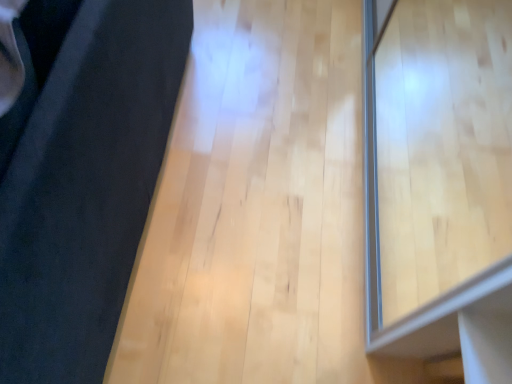
Question: Can you confirm if transparent glass window at right is positioned to the right of black fabric at left?

Choices:
 (A) yes
 (B) no

Answer: (A)

Question: Is transparent glass window at right wider than black fabric at left?

Choices:
 (A) yes
 (B) no

Answer: (B)

Question: Can we say transparent glass window at right lies outside black fabric at left?

Choices:
 (A) no
 (B) yes

Answer: (B)

Question: From the image's perspective, is transparent glass window at right located above black fabric at left?

Choices:
 (A) no
 (B) yes

Answer: (A)

Question: Does transparent glass window at right touch black fabric at left?

Choices:
 (A) yes
 (B) no

Answer: (B)

Question: Can you confirm if transparent glass window at right is shorter than black fabric at left?

Choices:
 (A) yes
 (B) no

Answer: (A)

Question: Can you confirm if black fabric at left is positioned to the right of transparent glass window at right?

Choices:
 (A) yes
 (B) no

Answer: (B)

Question: Does black fabric at left come behind transparent glass window at right?

Choices:
 (A) yes
 (B) no

Answer: (B)

Question: Considering the relative sizes of black fabric at left and transparent glass window at right in the image provided, is black fabric at left shorter than transparent glass window at right?

Choices:
 (A) yes
 (B) no

Answer: (B)

Question: Is transparent glass window at right at the back of black fabric at left?

Choices:
 (A) no
 (B) yes

Answer: (B)

Question: From the image's perspective, does black fabric at left appear higher than transparent glass window at right?

Choices:
 (A) no
 (B) yes

Answer: (B)

Question: Are black fabric at left and transparent glass window at right located far from each other?

Choices:
 (A) yes
 (B) no

Answer: (B)

Question: Would you say transparent glass window at right is inside or outside black fabric at left?

Choices:
 (A) inside
 (B) outside

Answer: (B)